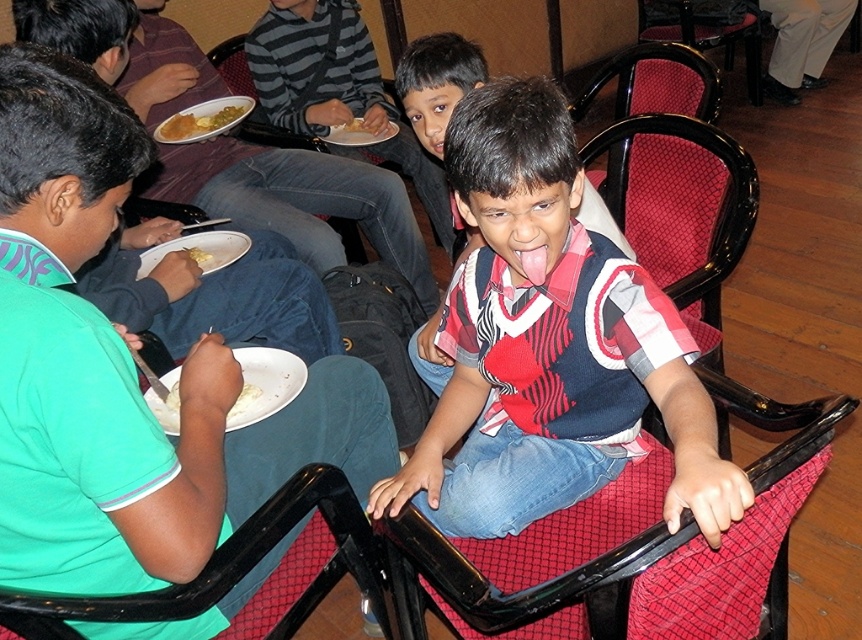
You are standing at the point labeled as point (x=205, y=257). If you turn around to face the direction opposite to where point (x=236, y=252) is located, which direction would you be facing?

Since point (x=236, y=252) is behind point (x=205, y=257), turning around to face the opposite direction would mean facing away from point (x=236, y=252). Therefore, you would be facing the direction opposite to where point (x=236, y=252) is located.